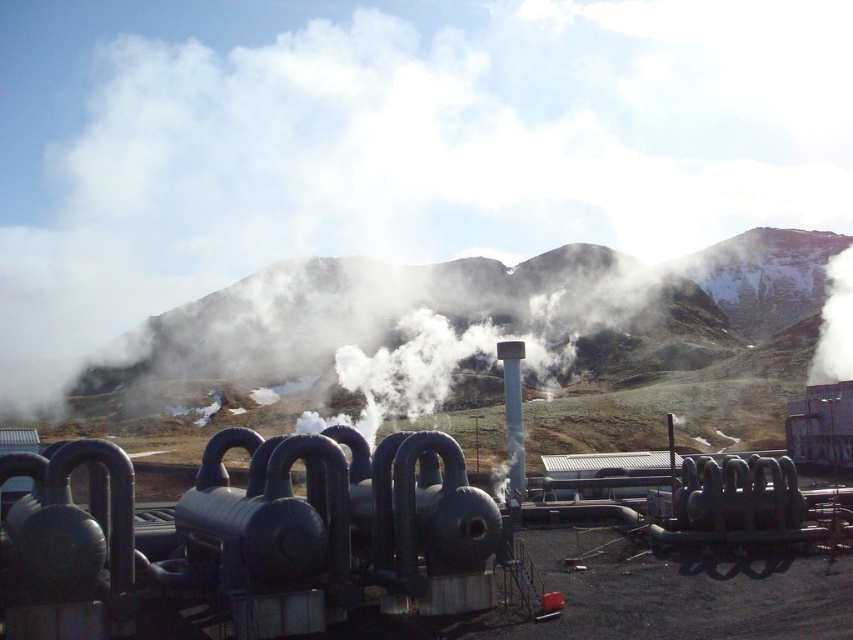
Which is above, white smoke at center or green grassy mountain at center?

Positioned higher is white smoke at center.

Can you confirm if white smoke at center is positioned below green grassy mountain at center?

No, white smoke at center is not below green grassy mountain at center.

Where is `white smoke at center`? This screenshot has width=853, height=640. white smoke at center is located at coordinates (387, 141).

At what (x,y) coordinates should I click in order to perform the action: click on white smoke at center. Please return your answer as a coordinate pair (x, y). The image size is (853, 640). Looking at the image, I should click on (387, 141).